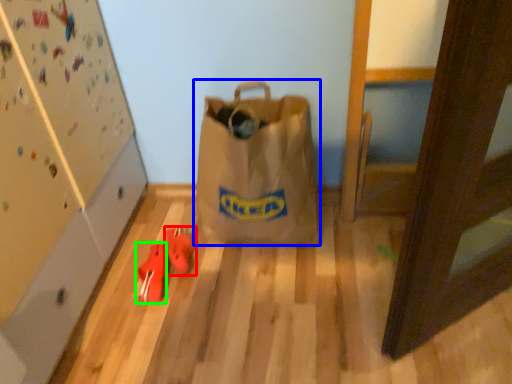
Question: Estimate the real-world distances between objects in this image. Which object is closer to footwear (highlighted by a red box), luggage and bags (highlighted by a blue box) or footwear (highlighted by a green box)?

Choices:
 (A) luggage and bags
 (B) footwear

Answer: (B)